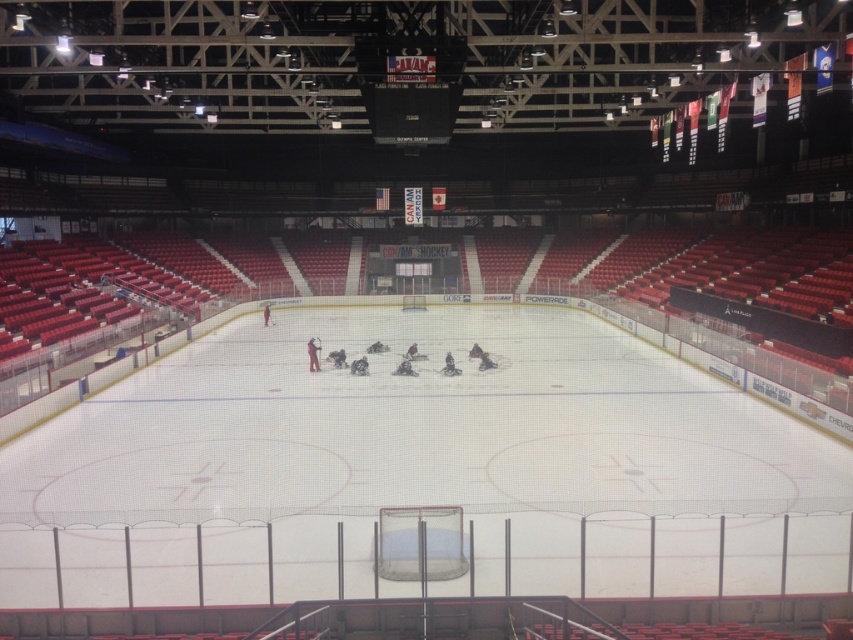
Describe the element at coordinates (404, 369) in the screenshot. The image size is (853, 640). I see `dark blue jersey at center` at that location.

Between dark blue jersey at center and white matte hockey at center, which one is positioned lower?

Positioned lower is dark blue jersey at center.

The height and width of the screenshot is (640, 853). Identify the location of dark blue jersey at center. (404, 369).

Image resolution: width=853 pixels, height=640 pixels. I want to click on dark blue jersey at center, so point(404,369).

Is black matte hockey stick at center wider than white matte hockey at center?

In fact, black matte hockey stick at center might be narrower than white matte hockey at center.

The image size is (853, 640). In order to click on black matte hockey stick at center in this screenshot , I will do `click(312, 353)`.

Where is `black matte hockey stick at center`? This screenshot has height=640, width=853. black matte hockey stick at center is located at coordinates (312, 353).

Can you confirm if white smooth ice at center is positioned below dark blue jersey at center?

Actually, white smooth ice at center is above dark blue jersey at center.

Which is above, white smooth ice at center or dark blue jersey at center?

white smooth ice at center is above.

Locate an element on the screen. white smooth ice at center is located at coordinates (421, 467).